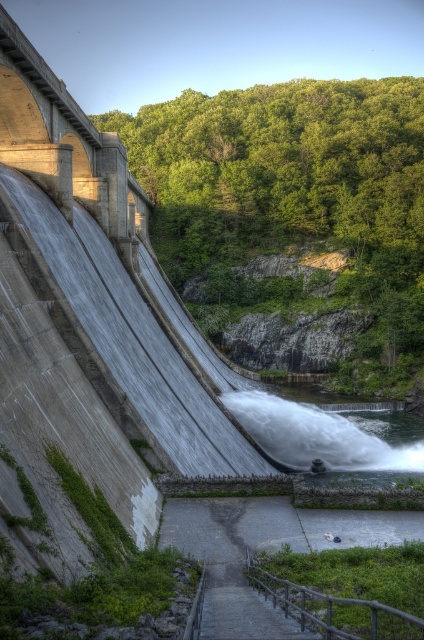
Question: Which of the following is the closest to the observer?

Choices:
 (A) (55, 115)
 (B) (345, 445)

Answer: (A)

Question: Does concrete bridge at left come in front of white frothy water at lower center?

Choices:
 (A) no
 (B) yes

Answer: (B)

Question: Does concrete bridge at left have a lesser width compared to white frothy water at lower center?

Choices:
 (A) yes
 (B) no

Answer: (A)

Question: Is concrete bridge at left positioned before white frothy water at lower center?

Choices:
 (A) yes
 (B) no

Answer: (A)

Question: Which point is closer to the camera?

Choices:
 (A) white frothy water at lower center
 (B) concrete bridge at left

Answer: (B)